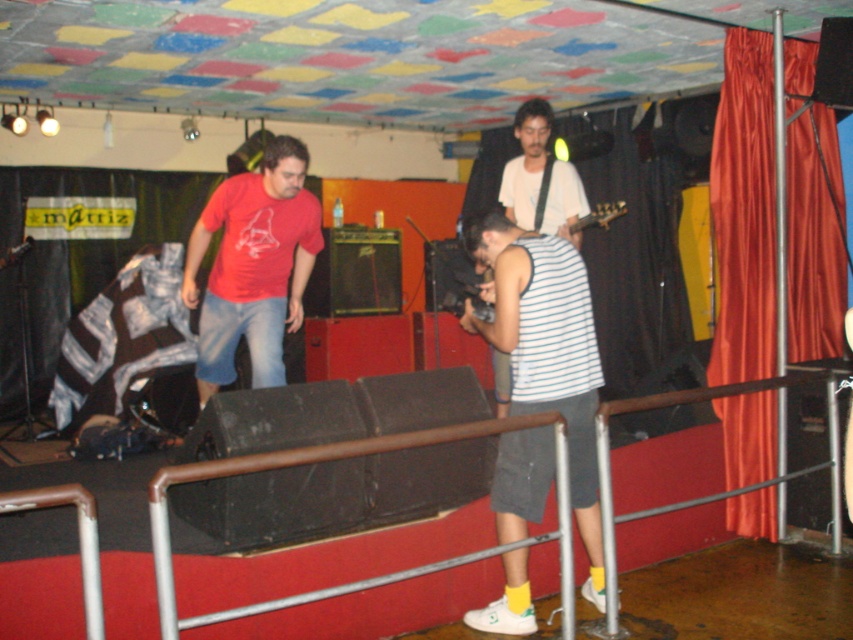
Does point (341, 604) lie in front of point (741, 109)?

Yes, point (341, 604) is in front of point (741, 109).

Between point (686, 436) and point (761, 502), which one is positioned in front?

Point (686, 436)

Which is behind, point (186, 579) or point (821, 330)?

Point (821, 330)

The height and width of the screenshot is (640, 853). What are the coordinates of `metal at center` in the screenshot? It's located at (316, 560).

Can you confirm if white striped tank top at center is thinner than white matte shirt at center?

Incorrect, white striped tank top at center's width is not less than white matte shirt at center's.

Does point (572, 266) lie behind point (508, 196)?

No, it is not.

Identify the location of white striped tank top at center. (546, 352).

Can you confirm if metal at center is wider than white striped tank top at center?

Yes.

Who is positioned more to the right, metal at center or white striped tank top at center?

From the viewer's perspective, white striped tank top at center appears more on the right side.

Between point (3, 538) and point (538, 358), which one is positioned behind?

Positioned behind is point (3, 538).

Find the location of `metal at center`. metal at center is located at coordinates (316, 560).